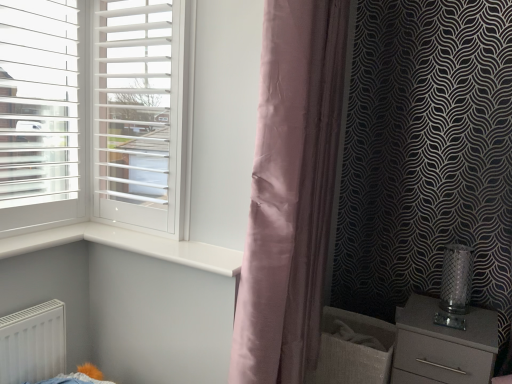
Question: Can you confirm if white matte screen door at left is positioned to the left of silky pink curtain at center?

Choices:
 (A) no
 (B) yes

Answer: (B)

Question: Considering the relative sizes of white matte screen door at left and silky pink curtain at center in the image provided, is white matte screen door at left thinner than silky pink curtain at center?

Choices:
 (A) no
 (B) yes

Answer: (B)

Question: From a real-world perspective, is white matte screen door at left physically below silky pink curtain at center?

Choices:
 (A) yes
 (B) no

Answer: (B)

Question: From the image's perspective, is white matte screen door at left over silky pink curtain at center?

Choices:
 (A) yes
 (B) no

Answer: (A)

Question: Can we say white matte screen door at left lies outside silky pink curtain at center?

Choices:
 (A) no
 (B) yes

Answer: (B)

Question: Can you confirm if white matte screen door at left is smaller than silky pink curtain at center?

Choices:
 (A) yes
 (B) no

Answer: (A)

Question: From a real-world perspective, is satin grey chest of drawers at lower right below silky pink curtain at center?

Choices:
 (A) no
 (B) yes

Answer: (B)

Question: Is satin grey chest of drawers at lower right facing away from silky pink curtain at center?

Choices:
 (A) no
 (B) yes

Answer: (A)

Question: Can you confirm if satin grey chest of drawers at lower right is bigger than silky pink curtain at center?

Choices:
 (A) yes
 (B) no

Answer: (B)

Question: Is satin grey chest of drawers at lower right not close to silky pink curtain at center?

Choices:
 (A) yes
 (B) no

Answer: (B)

Question: From the image's perspective, would you say satin grey chest of drawers at lower right is positioned over silky pink curtain at center?

Choices:
 (A) yes
 (B) no

Answer: (B)

Question: Can you confirm if satin grey chest of drawers at lower right is taller than silky pink curtain at center?

Choices:
 (A) yes
 (B) no

Answer: (B)

Question: Is satin grey chest of drawers at lower right shorter than white glossy window sill at center?

Choices:
 (A) no
 (B) yes

Answer: (A)